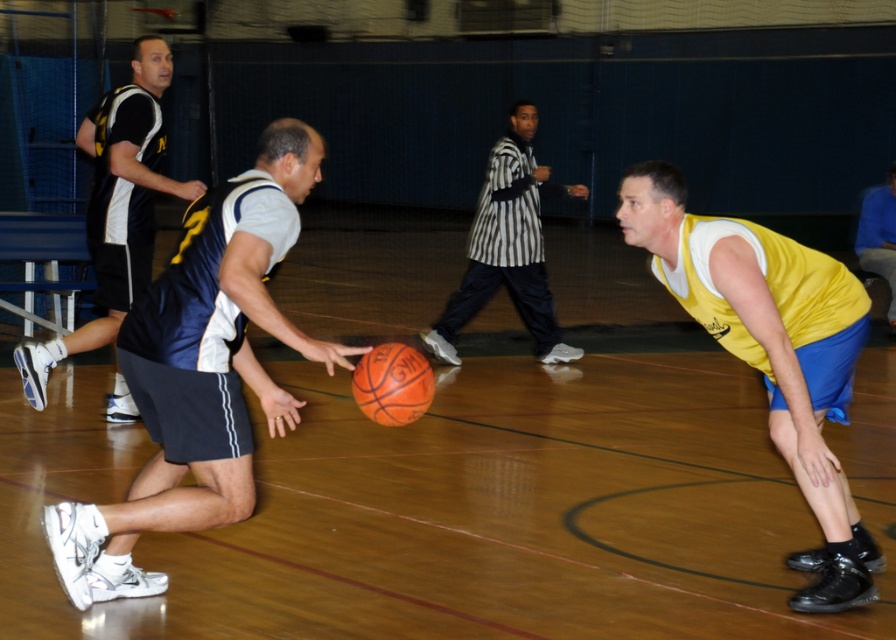
You are a basketball player trying to pass the ball to a teammate. You notice two points marked on the court. The first point is at coordinate point (127,289) and the second is at coordinate point (890,196). Which point is closer to your current position if you are facing the basket?

Point (127,289) is in front of point (890,196), so if you are facing the basket, the point (127,289) is closer to your current position.

You are a referee observing the game. You need to determine if the blue jersey at center has enough space to pass the ball to a teammate without colliding with the yellow jersey at right. Can you confirm if there is sufficient space between them?

The blue jersey at center might be wider than yellow jersey at right, so there may not be enough space to pass safely without collision risk.